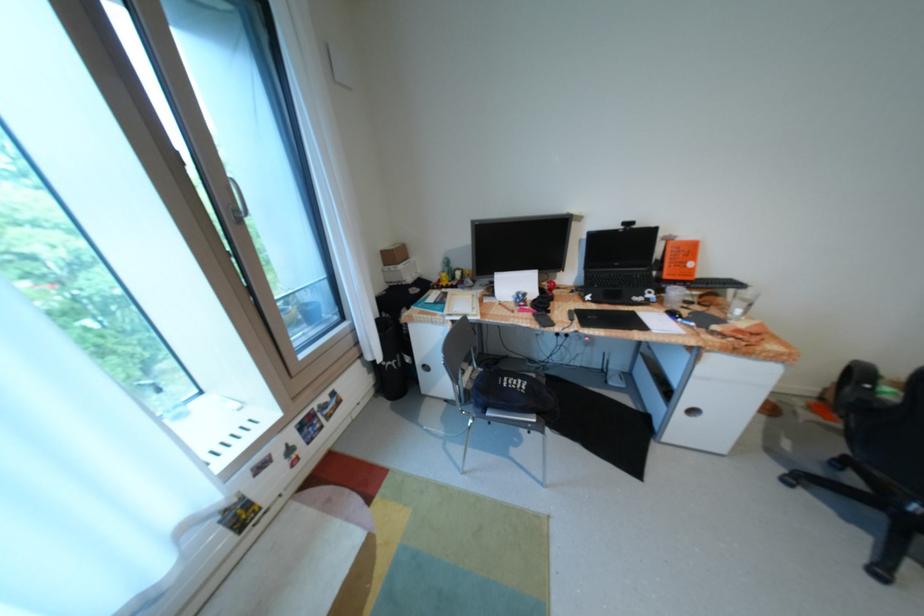
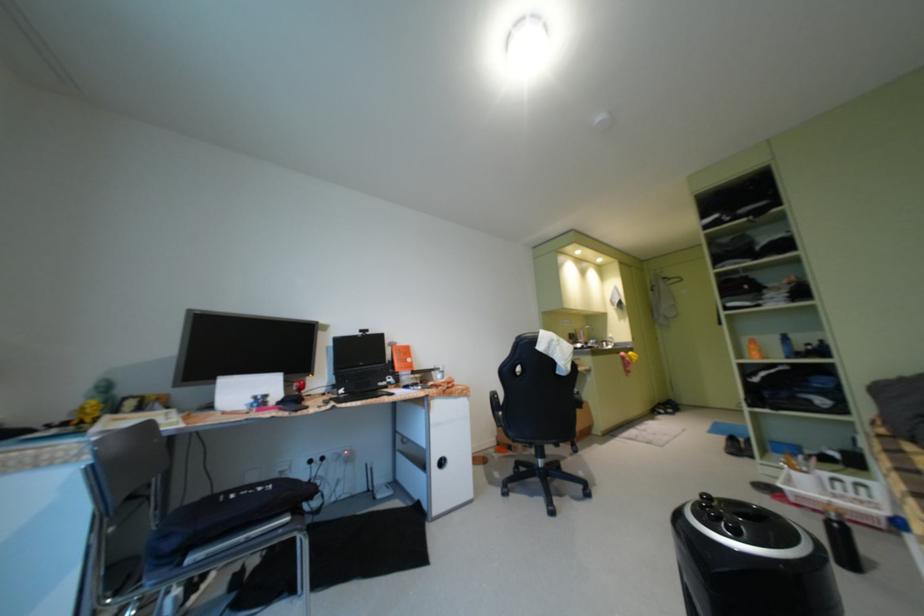
The first image is from the beginning of the video and the second image is from the end. How did the camera likely rotate when shooting the video?

The camera's rotation is toward right-up.